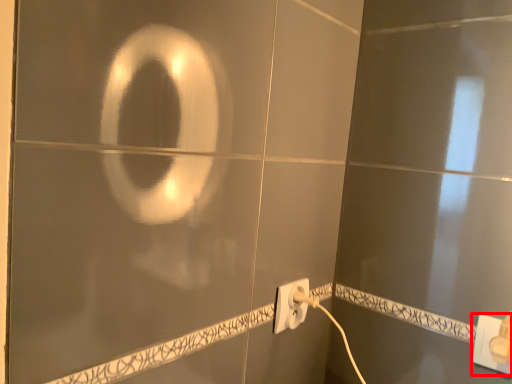
Question: From the image's perspective, where is power plugs and sockets (annotated by the red box) located relative to power plugs and sockets?

Choices:
 (A) above
 (B) below

Answer: (B)